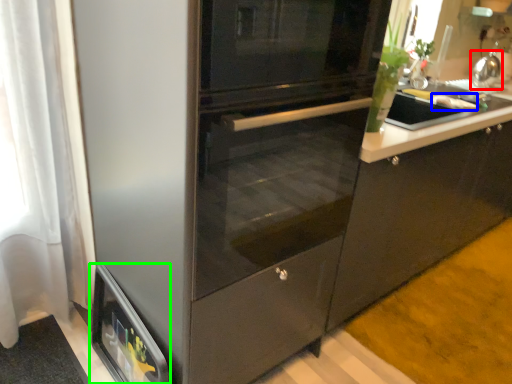
Question: Based on their relative distances, which object is nearer to kitchen appliance (highlighted by a red box)? Choose from food (highlighted by a blue box) and home appliance (highlighted by a green box).

Choices:
 (A) food
 (B) home appliance

Answer: (A)